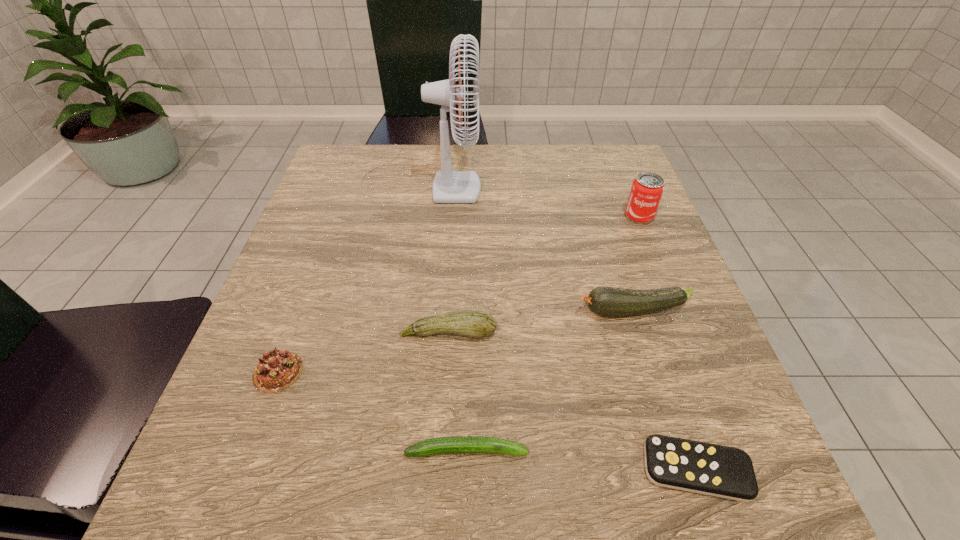
Image resolution: width=960 pixels, height=540 pixels. Identify the location of vacant region located at the blossom end of the rightmost zucchini. (399, 311).

Image resolution: width=960 pixels, height=540 pixels. I want to click on vacant area situated 0.180m at the blossom end of the rightmost zucchini, so click(x=480, y=311).

The height and width of the screenshot is (540, 960). Find the location of `blank space located at the blossom end of the rightmost zucchini`. blank space located at the blossom end of the rightmost zucchini is located at coordinates (539, 311).

Where is `vacant space located at the stem end of the fourth shortest object`? The image size is (960, 540). vacant space located at the stem end of the fourth shortest object is located at coordinates [440, 480].

Identify the location of vacant area situated 0.190m on the back of the fifth tallest object. (314, 273).

Find the location of a particular element. The image size is (960, 540). vacant region located on the front-facing side of the nearest zucchini is located at coordinates (665, 450).

Where is `vacant area situated on the left of the remote control`? This screenshot has width=960, height=540. vacant area situated on the left of the remote control is located at coordinates (502, 469).

Locate an element on the screen. The height and width of the screenshot is (540, 960). object located in the far edge section of the desktop is located at coordinates (449, 186).

This screenshot has width=960, height=540. I want to click on zucchini positioned at the near edge, so click(458, 444).

You are a GUI agent. You are given a task and a screenshot of the screen. Output one action in this format:
    pyautogui.click(x=<x>, y=<y>)
    Task: Click on the remote control positioned at the near edge
    This screenshot has width=960, height=540.
    Given the screenshot: What is the action you would take?
    pyautogui.click(x=716, y=470)